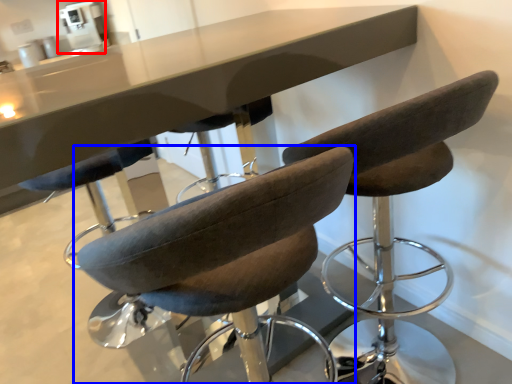
Question: Which object is closer to the camera taking this photo, coffee machine (highlighted by a red box) or chair (highlighted by a blue box)?

Choices:
 (A) coffee machine
 (B) chair

Answer: (B)